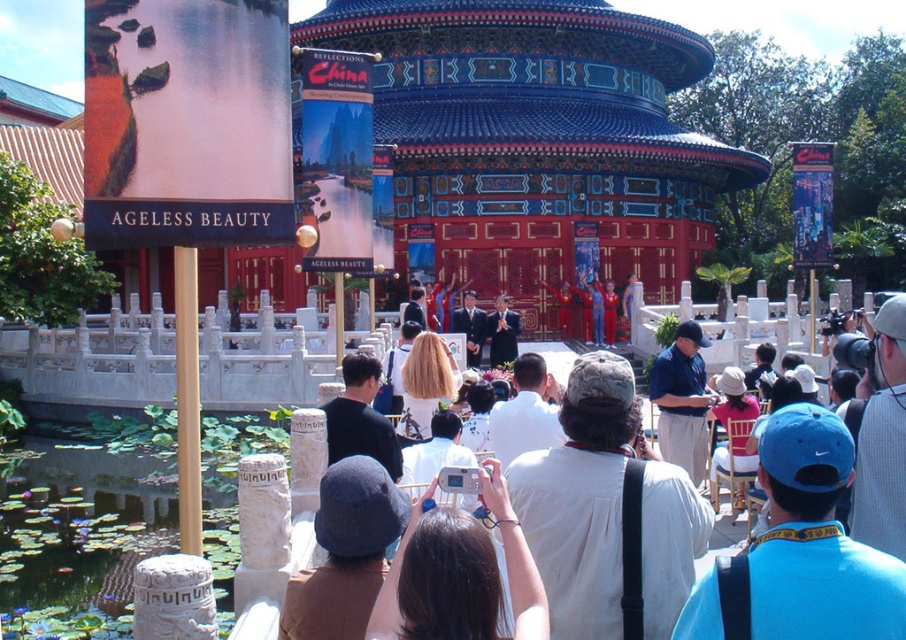
Does green lily pads at lower left have a lesser height compared to blonde hair at center?

No.

Is green lily pads at lower left thinner than blonde hair at center?

No, green lily pads at lower left is not thinner than blonde hair at center.

Image resolution: width=906 pixels, height=640 pixels. What do you see at coordinates (79, 536) in the screenshot?
I see `green lily pads at lower left` at bounding box center [79, 536].

Where is `green lily pads at lower left`? The height and width of the screenshot is (640, 906). green lily pads at lower left is located at coordinates (x=79, y=536).

Is point (583, 628) closer to viewer compared to point (15, 602)?

Yes, point (583, 628) is in front of point (15, 602).

Is camouflage hat at center to the right of green lily pads at lower left from the viewer's perspective?

Yes, camouflage hat at center is to the right of green lily pads at lower left.

Locate an element on the screen. camouflage hat at center is located at coordinates (606, 515).

In the scene shown: Between dark blue felt hat at center and blonde hair at center, which one has more height?

dark blue felt hat at center

Is dark blue felt hat at center to the left of blonde hair at center from the viewer's perspective?

Correct, you'll find dark blue felt hat at center to the left of blonde hair at center.

Where is `dark blue felt hat at center`? The width and height of the screenshot is (906, 640). dark blue felt hat at center is located at coordinates (345, 552).